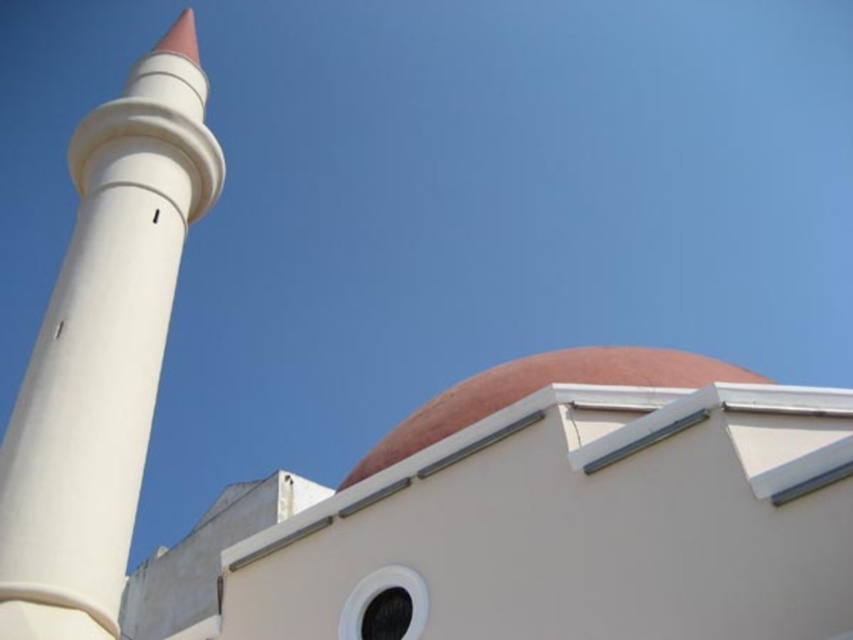
You are an architect planning to install a new lighting system between the white smooth minaret at left and the matte pink dome at center. The recommended minimum distance between two light fixtures is 20 meters. Based on the scene, will the current spacing between these two structures allow for proper installation according to the guidelines?

The distance between the white smooth minaret at left and the matte pink dome at center is 19.89 meters, which is slightly less than the recommended 20 meters. Therefore, the current spacing does not meet the guidelines for proper installation.

You are an architect analyzing the building structure. You notice the white smooth minaret at left and the matte pink dome at center. Which one is positioned higher in the image?

The white smooth minaret at left is located above the matte pink dome at center, so it is positioned higher in the image.

You are standing in front of the building and want to take a photo. You notice two points marked on the structure. The first point is at coordinate point (204, 77) and the second is at point (480, 412). Which point is closer to your camera?

Point (204, 77) is further to the camera than point (480, 412), so the second point is closer to your camera.